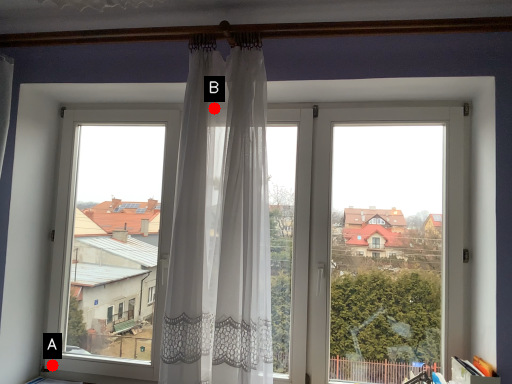
Question: Two points are circled on the image, labeled by A and B beside each circle. Which point is farther from the camera taking this photo?

Choices:
 (A) A is further
 (B) B is further

Answer: (A)